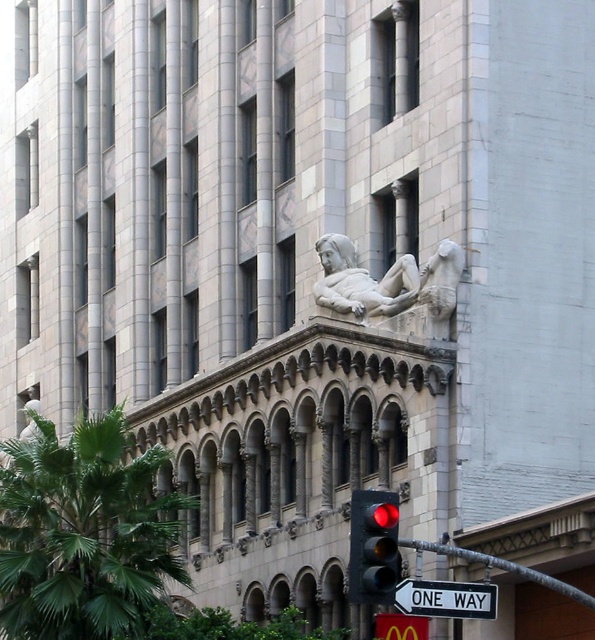
You are an architect examining the building facade. You notice the stone statue at center and the white plastic sign at lower right. Which object has a greater height?

The white plastic sign at lower right is taller than the stone statue at center.

You are standing in front of a classical building and want to take a photo of the sculpted reclining woman on its upper facade. Your camera has a maximum focus range of 60 meters. Will the point at coordinates point (x=79, y=518) be within the camera focus range?

The point (x=79, y=518) is 61.42 meters away from the camera, which exceeds the camera maximum focus range of 60 meters. Therefore, the camera cannot focus on that point.

You are an architect assessing the building facade. You need to determine if the stone statue at center can be placed on a pedestal that is designed to hold objects narrower than the white plastic sign at lower right. Can the statue fit on the pedestal?

The stone statue at center is narrower than the white plastic sign at lower right, so it can fit on the pedestal designed for objects narrower than the sign.